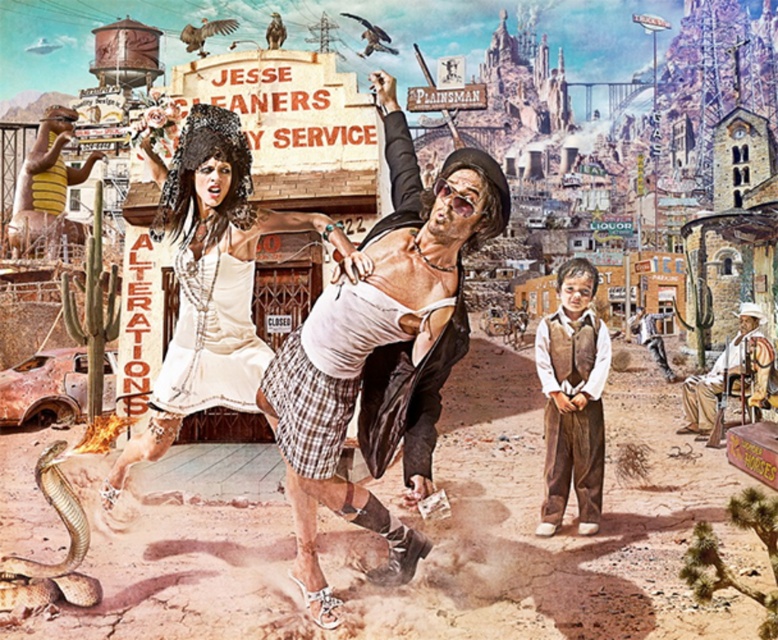
Does brown cotton vest at lower right appear under rustic wooden chair at lower right?

Yes.

Measure the distance from brown cotton vest at lower right to rustic wooden chair at lower right.

The distance of brown cotton vest at lower right from rustic wooden chair at lower right is 14.58 meters.

Between point (586, 500) and point (759, 308), which one is positioned behind?

Positioned behind is point (759, 308).

This screenshot has width=778, height=640. What are the coordinates of `brown cotton vest at lower right` in the screenshot? It's located at (573, 397).

Does white lace dress at center have a larger size compared to rustic wooden chair at lower right?

Incorrect, white lace dress at center is not larger than rustic wooden chair at lower right.

Is white lace dress at center smaller than rustic wooden chair at lower right?

Yes, white lace dress at center is smaller than rustic wooden chair at lower right.

Is point (256, 224) less distant than point (743, 323)?

Yes, point (256, 224) is closer to viewer.

Find the location of a particular element. white lace dress at center is located at coordinates (212, 280).

Can you confirm if yellow striped shirt at left is positioned above shiny brown snake at lower left?

Correct, yellow striped shirt at left is located above shiny brown snake at lower left.

Between point (67, 243) and point (37, 465), which one is positioned behind?

The point (67, 243) is more distant.

This screenshot has width=778, height=640. I want to click on yellow striped shirt at left, so click(x=47, y=188).